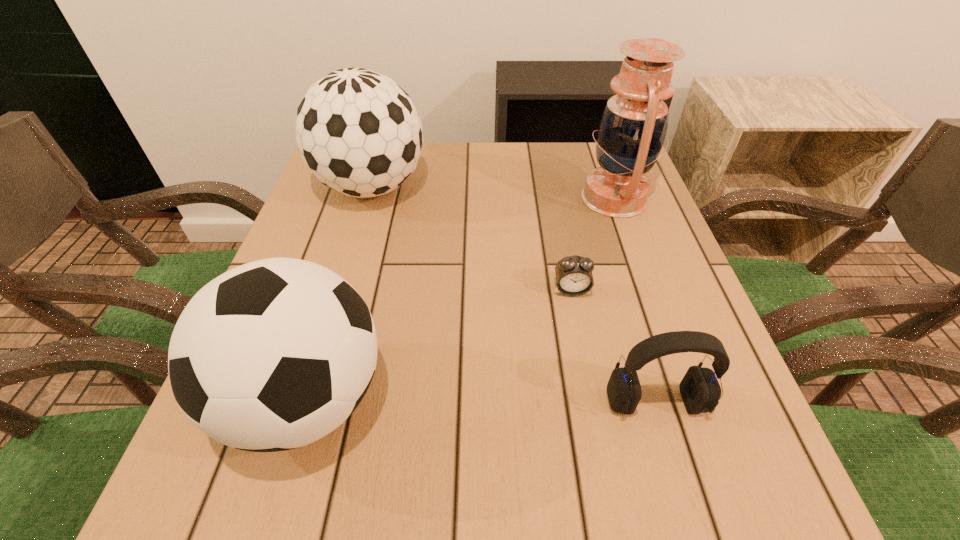
Find the location of a particular element. unoccupied area between the oil lamp and the headset is located at coordinates (635, 300).

You are a GUI agent. You are given a task and a screenshot of the screen. Output one action in this format:
    pyautogui.click(x=<x>, y=<y>)
    Task: Click on the free spot between the third nearest object and the nearer soccer ball
    The image size is (960, 540).
    Given the screenshot: What is the action you would take?
    pyautogui.click(x=439, y=344)

You are a GUI agent. You are given a task and a screenshot of the screen. Output one action in this format:
    pyautogui.click(x=<x>, y=<y>)
    Task: Click on the free space between the farther soccer ball and the alarm clock
    The height and width of the screenshot is (540, 960).
    Given the screenshot: What is the action you would take?
    pyautogui.click(x=471, y=239)

At what (x,y) coordinates should I click in order to perform the action: click on empty location between the tallest object and the fourth tallest object. Please return your answer as a coordinate pair (x, y). This screenshot has width=960, height=540. Looking at the image, I should click on (635, 300).

Where is `free spot between the nearer soccer ball and the third nearest object`? Image resolution: width=960 pixels, height=540 pixels. free spot between the nearer soccer ball and the third nearest object is located at coordinates (439, 344).

You are a GUI agent. You are given a task and a screenshot of the screen. Output one action in this format:
    pyautogui.click(x=<x>, y=<y>)
    Task: Click on the object that is the third closest to the nearer soccer ball
    The image size is (960, 540).
    Given the screenshot: What is the action you would take?
    pyautogui.click(x=700, y=390)

Identify which object is the closest to the shortest object. Please provide its 2D coordinates. Your answer should be formatted as a tuple, i.e. [(x, y)], where the tuple contains the x and y coordinates of a point satisfying the conditions above.

[(632, 130)]

You are a GUI agent. You are given a task and a screenshot of the screen. Output one action in this format:
    pyautogui.click(x=<x>, y=<y>)
    Task: Click on the free space in the image that satisfies the following two spatial constraints: 1. on the back side of the nearer soccer ball; 2. on the right side of the oil lamp
    Image resolution: width=960 pixels, height=540 pixels.
    Given the screenshot: What is the action you would take?
    pyautogui.click(x=367, y=198)